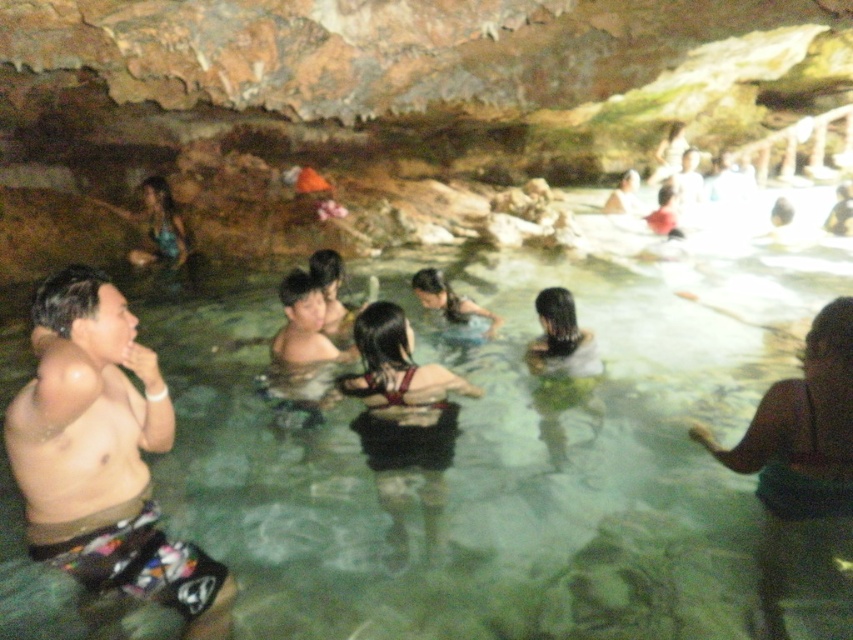
Question: Which point is farther to the camera?

Choices:
 (A) dark hair at center
 (B) matte red swimsuit at upper right
 (C) dark red bikini top at center
 (D) clear water pool at center

Answer: (B)

Question: Which object appears farthest from the camera in this image?

Choices:
 (A) dark hair at center
 (B) skinny brown shorts at left
 (C) dark brown hair at center

Answer: (C)

Question: Can you confirm if skinny brown shorts at left is wider than dark brown hair at center?

Choices:
 (A) no
 (B) yes

Answer: (B)

Question: Is dark red bikini top at center behind dark brown hair at center?

Choices:
 (A) no
 (B) yes

Answer: (A)

Question: Which point appears closest to the camera in this image?

Choices:
 (A) (546, 348)
 (B) (668, 216)

Answer: (A)

Question: Does clear water pool at center appear on the right side of dark hair at center?

Choices:
 (A) no
 (B) yes

Answer: (A)